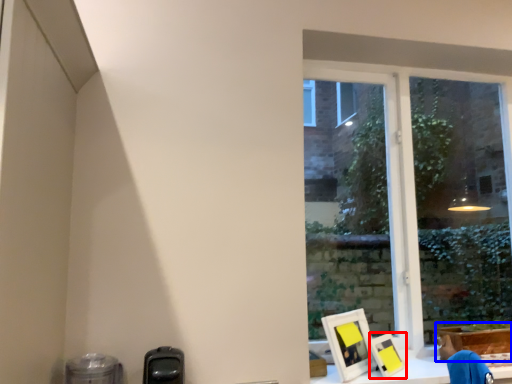
Question: Which object is closer to the camera taking this photo, picture frame (highlighted by a red box) or cardboard box (highlighted by a blue box)?

Choices:
 (A) picture frame
 (B) cardboard box

Answer: (A)